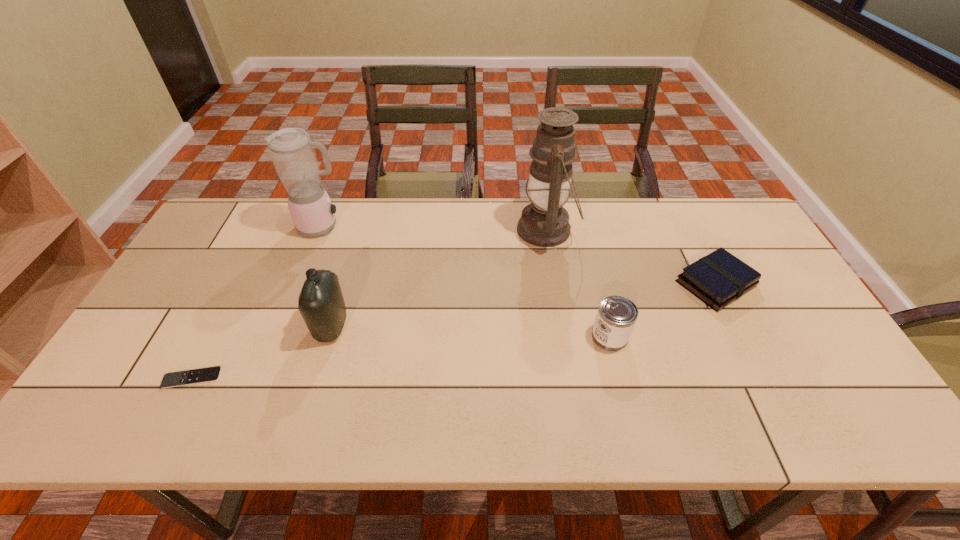
Image resolution: width=960 pixels, height=540 pixels. Identify the location of vacant area that satisfies the following two spatial constraints: 1. on the back side of the nearest object; 2. on the left side of the third shortest object. (213, 336).

Locate an element on the screen. free point that satisfies the following two spatial constraints: 1. on the base of the food processor near the control knob; 2. on the left side of the fourth tallest object is located at coordinates (279, 336).

Image resolution: width=960 pixels, height=540 pixels. Identify the location of vacant space that satisfies the following two spatial constraints: 1. on the front side of the fourth tallest object; 2. on the right side of the third object from left to right. (328, 336).

Find the location of a particular element. The height and width of the screenshot is (540, 960). free space that satisfies the following two spatial constraints: 1. on the front side of the tallest object; 2. on the left side of the can is located at coordinates click(x=564, y=336).

Locate an element on the screen. This screenshot has width=960, height=540. blank space that satisfies the following two spatial constraints: 1. on the back side of the can; 2. on the right side of the rightmost object is located at coordinates (596, 284).

I want to click on blank space that satisfies the following two spatial constraints: 1. on the front side of the third shortest object; 2. on the left side of the bottle, so [328, 336].